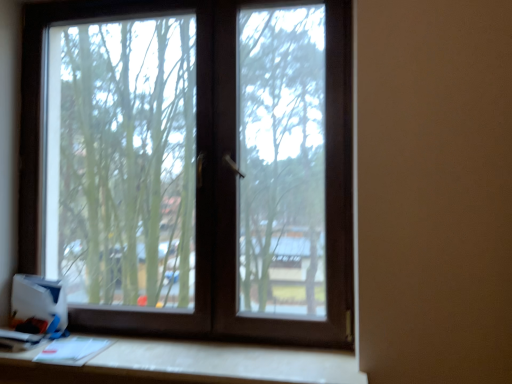
Question: Considering the positions of point (295, 380) and point (25, 304), is point (295, 380) closer or farther from the camera than point (25, 304)?

Choices:
 (A) farther
 (B) closer

Answer: (B)

Question: Is white matte table at lower center inside or outside of white cardboard box at lower left?

Choices:
 (A) outside
 (B) inside

Answer: (A)

Question: Which object is the farthest from the white matte table at lower center?

Choices:
 (A) white cardboard box at lower left
 (B) brown matte window at center

Answer: (B)

Question: Which is farther from the white matte table at lower center?

Choices:
 (A) white cardboard box at lower left
 (B) brown matte window at center

Answer: (B)